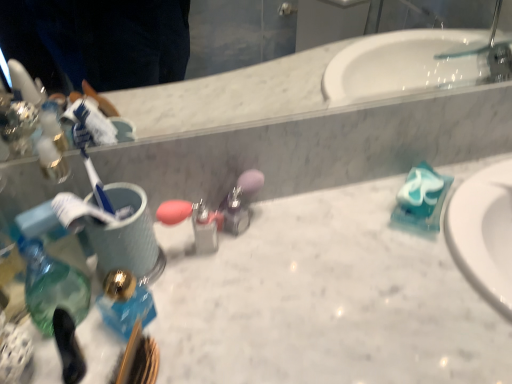
Question: Is white marble counter top at center located within translucent glass soap dispenser at left?

Choices:
 (A) yes
 (B) no

Answer: (B)

Question: Is translucent glass soap dispenser at left facing away from white marble counter top at center?

Choices:
 (A) yes
 (B) no

Answer: (B)

Question: Is translucent glass soap dispenser at left behind white marble counter top at center?

Choices:
 (A) yes
 (B) no

Answer: (A)

Question: Can you confirm if translucent glass soap dispenser at left is bigger than white marble counter top at center?

Choices:
 (A) yes
 (B) no

Answer: (B)

Question: Would you say translucent glass soap dispenser at left is outside white marble counter top at center?

Choices:
 (A) no
 (B) yes

Answer: (B)

Question: Considering the relative sizes of translucent glass soap dispenser at left and white marble counter top at center in the image provided, is translucent glass soap dispenser at left taller than white marble counter top at center?

Choices:
 (A) yes
 (B) no

Answer: (B)

Question: Is translucent glass soap dispenser at left a part of white marble counter top at center?

Choices:
 (A) yes
 (B) no

Answer: (B)

Question: From a real-world perspective, is white marble counter top at center beneath translucent glass soap dispenser at left?

Choices:
 (A) no
 (B) yes

Answer: (B)

Question: Considering the relative positions of white marble counter top at center and translucent glass soap dispenser at left in the image provided, is white marble counter top at center to the right of translucent glass soap dispenser at left from the viewer's perspective?

Choices:
 (A) no
 (B) yes

Answer: (B)

Question: From the image's perspective, is white marble counter top at center beneath translucent glass soap dispenser at left?

Choices:
 (A) no
 (B) yes

Answer: (B)

Question: Is white marble counter top at center smaller than translucent glass soap dispenser at left?

Choices:
 (A) yes
 (B) no

Answer: (B)

Question: Can you confirm if white marble counter top at center is taller than translucent glass soap dispenser at left?

Choices:
 (A) no
 (B) yes

Answer: (B)

Question: Considering the positions of point (356, 296) and point (53, 309), is point (356, 296) closer or farther from the camera than point (53, 309)?

Choices:
 (A) closer
 (B) farther

Answer: (B)